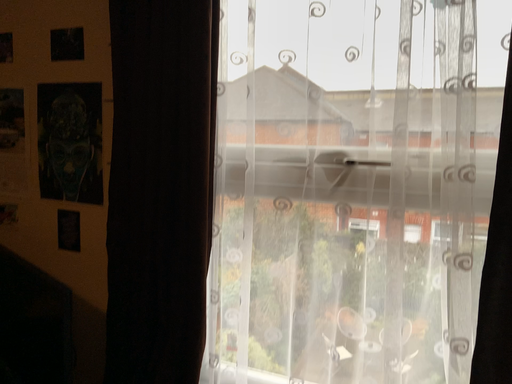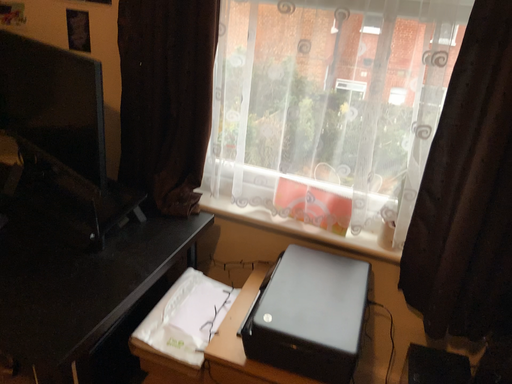
Question: Which way did the camera rotate in the video?

Choices:
 (A) rotated upward
 (B) rotated downward

Answer: (B)